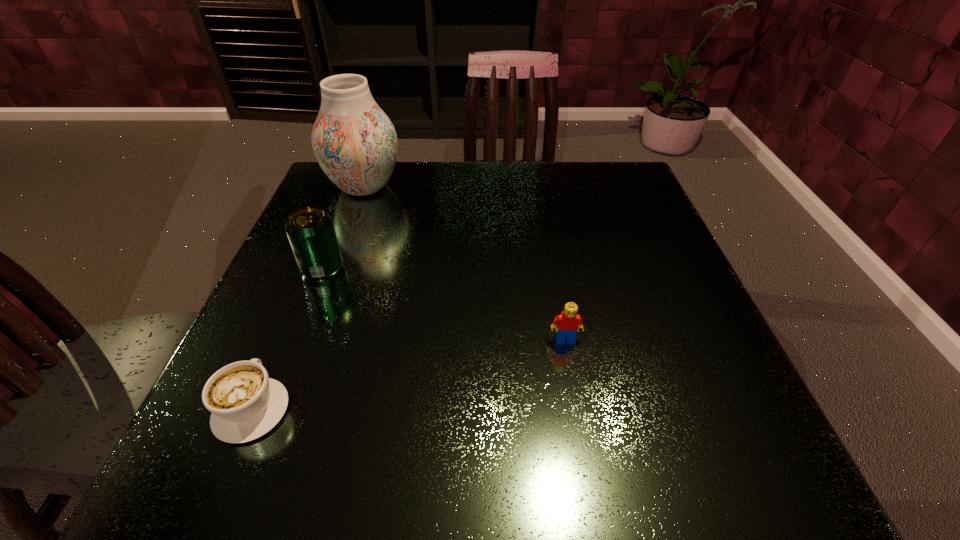
Identify the location of unoccupied position between the tallest object and the cappuccino. The image size is (960, 540). (308, 298).

Identify the location of free space between the vase and the third nearest object. (344, 228).

Find the location of a particular element. vacant space in between the third farthest object and the beer can is located at coordinates (444, 304).

I want to click on free area in between the farthest object and the second shortest object, so click(x=465, y=264).

Find the location of a particular element. The height and width of the screenshot is (540, 960). empty space that is in between the second tallest object and the farthest object is located at coordinates (344, 228).

Find the location of `vacant space that is in between the tallest object and the second farthest object`. vacant space that is in between the tallest object and the second farthest object is located at coordinates (344, 228).

You are a GUI agent. You are given a task and a screenshot of the screen. Output one action in this format:
    pyautogui.click(x=<x>, y=<y>)
    Task: Click on the empty space between the vase and the Lego
    Image resolution: width=960 pixels, height=540 pixels.
    Given the screenshot: What is the action you would take?
    pyautogui.click(x=465, y=264)

Locate an element on the screen. object that is the closest to the Lego is located at coordinates (245, 403).

Identify which object is the third nearest to the farthest object. Please provide its 2D coordinates. Your answer should be formatted as a tuple, i.e. [(x, y)], where the tuple contains the x and y coordinates of a point satisfying the conditions above.

[(568, 322)]

What are the coordinates of `vacant space that satisfies the following two spatial constraints: 1. to the right of the vase's handle; 2. on the right side of the nearest object` in the screenshot? It's located at (345, 187).